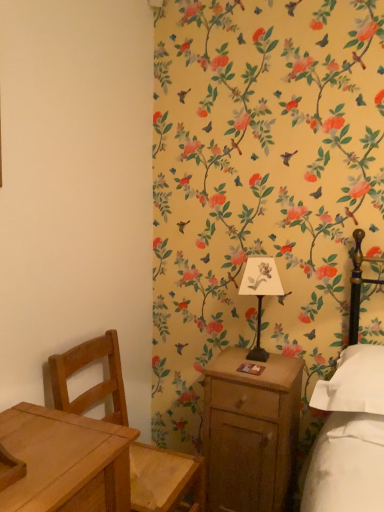
Question: Is light brown wooden chair at left inside the boundaries of wooden nightstand at right, or outside?

Choices:
 (A) inside
 (B) outside

Answer: (B)

Question: Considering their positions, is light brown wooden chair at left located in front of or behind wooden nightstand at right?

Choices:
 (A) front
 (B) behind

Answer: (A)

Question: Considering the real-world distances, which object is closest to the wooden nightstand at right?

Choices:
 (A) light brown wooden chair at left
 (B) metallic black bedside lamp at center-right

Answer: (B)

Question: Which object is the farthest from the wooden nightstand at right?

Choices:
 (A) metallic black bedside lamp at center-right
 (B) light brown wooden chair at left

Answer: (B)